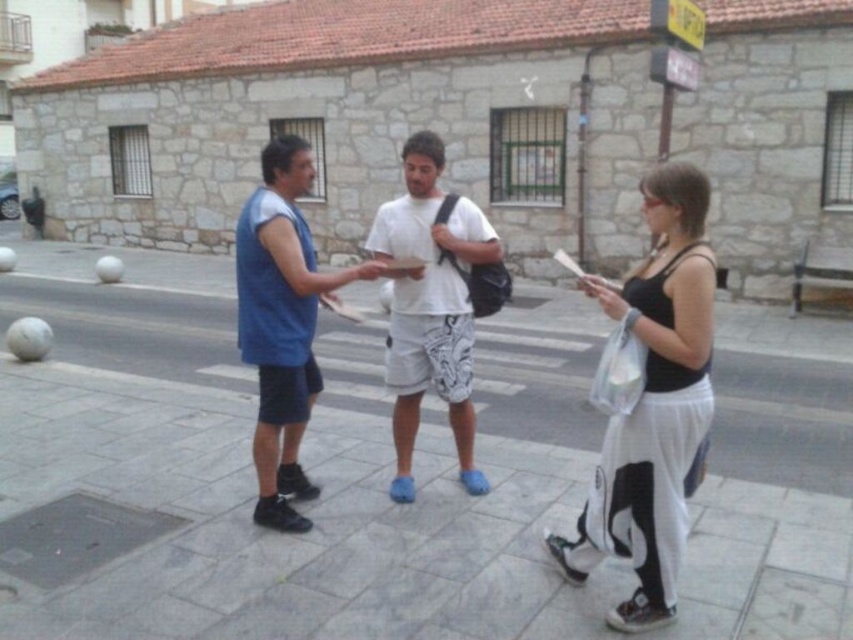
Is black tank top at center thinner than blue fabric shirt at center?

Indeed, black tank top at center has a lesser width compared to blue fabric shirt at center.

Is black tank top at center smaller than blue fabric shirt at center?

No, black tank top at center is not smaller than blue fabric shirt at center.

Which is in front, point (689, 305) or point (270, 422)?

Point (689, 305) is more forward.

Where is `black tank top at center`? black tank top at center is located at coordinates coord(653,404).

Measure the distance between gray stone pavement at center and blue fabric shirt at center.

gray stone pavement at center and blue fabric shirt at center are 8.21 feet apart from each other.

Locate an element on the screen. The width and height of the screenshot is (853, 640). gray stone pavement at center is located at coordinates (299, 504).

Locate an element on the screen. The width and height of the screenshot is (853, 640). gray stone pavement at center is located at coordinates (299, 504).

Is gray stone pavement at center positioned at the back of black tank top at center?

Yes, it is.

Is gray stone pavement at center wider than black tank top at center?

Indeed, gray stone pavement at center has a greater width compared to black tank top at center.

You are a GUI agent. You are given a task and a screenshot of the screen. Output one action in this format:
    pyautogui.click(x=<x>, y=<y>)
    Task: Click on the gray stone pavement at center
    The width and height of the screenshot is (853, 640).
    Given the screenshot: What is the action you would take?
    pyautogui.click(x=299, y=504)